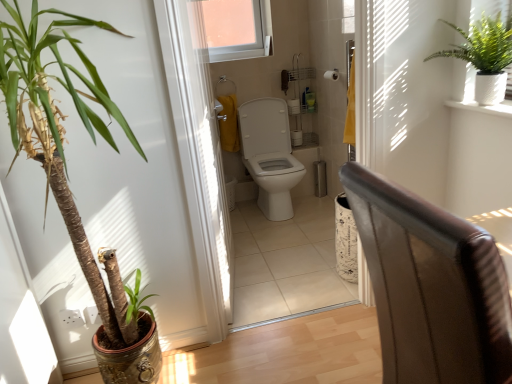
You are a GUI agent. You are given a task and a screenshot of the screen. Output one action in this format:
    pyautogui.click(x=<x>, y=<y>)
    Task: Click on the vacant area that lies to the right of white plastic screen door at center
    The image size is (512, 384).
    Given the screenshot: What is the action you would take?
    pyautogui.click(x=272, y=275)